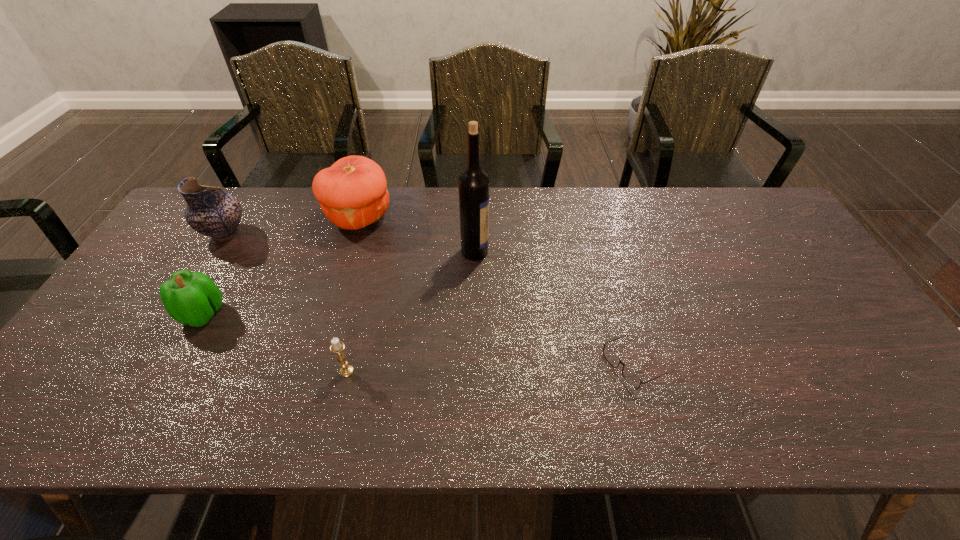
Locate an element on the screen. vacant region located on the front of the pottery is located at coordinates [x=204, y=268].

Where is `free space located on the left of the bell pepper`? This screenshot has width=960, height=540. free space located on the left of the bell pepper is located at coordinates (115, 314).

The height and width of the screenshot is (540, 960). I want to click on vacant space situated 0.300m on the back of the candle holder, so 370,274.

Locate an element on the screen. This screenshot has height=540, width=960. vacant space located 0.180m with the lenses facing outward on the shortest object is located at coordinates (528, 366).

Find the location of a particular element. This screenshot has width=960, height=540. vacant region located with the lenses facing outward on the shortest object is located at coordinates (440, 366).

Locate an element on the screen. This screenshot has width=960, height=540. free location located 0.240m with the lenses facing outward on the shortest object is located at coordinates [503, 366].

Locate an element on the screen. Image resolution: width=960 pixels, height=540 pixels. pumpkin at the far edge is located at coordinates (352, 193).

At what (x,y) coordinates should I click in order to perform the action: click on pottery located at the far edge. Please return your answer as a coordinate pair (x, y). Looking at the image, I should click on (210, 211).

This screenshot has width=960, height=540. Find the location of `object present at the left edge`. object present at the left edge is located at coordinates (210, 211).

The image size is (960, 540). Identify the location of object that is positioned at the far left corner. (210, 211).